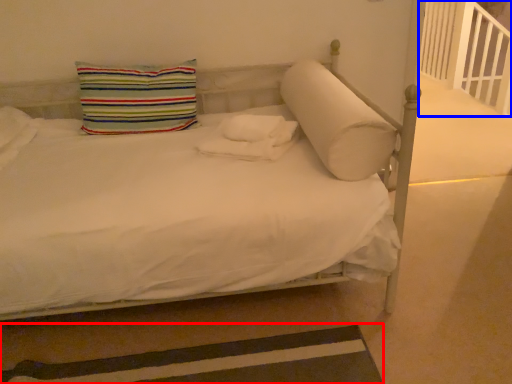
Question: Which object appears closest to the camera in this image, strip (highlighted by a red box) or balustrade (highlighted by a blue box)?

Choices:
 (A) strip
 (B) balustrade

Answer: (A)